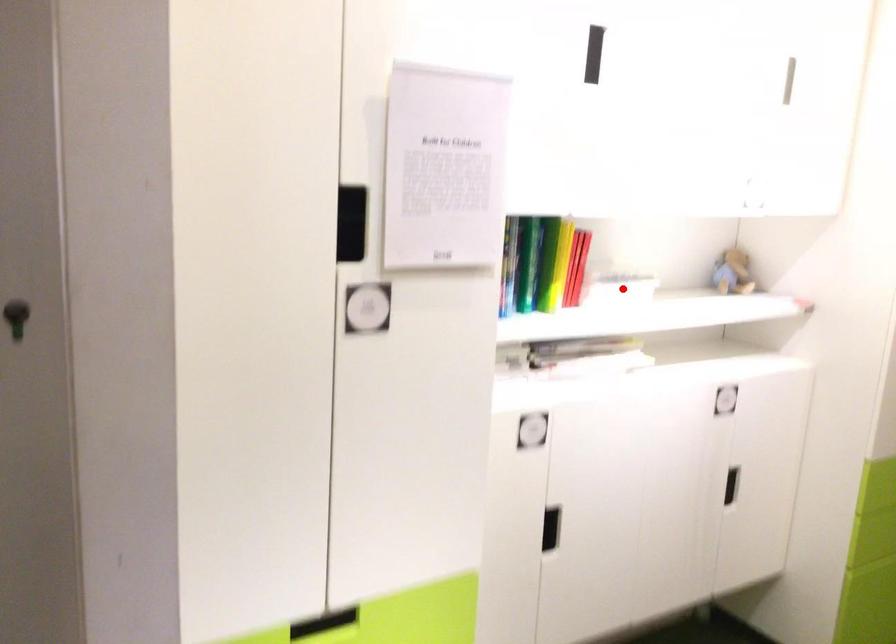
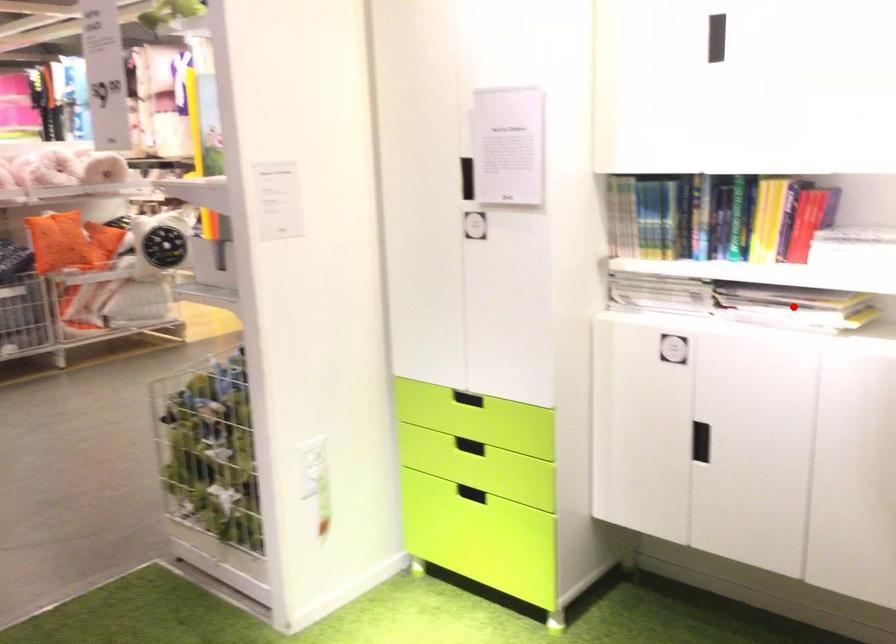
I am providing you with two images of the same scene from different viewpoints. A red point is marked on the first image and another point is marked on the second image. Is the red point in image1 aligned with the point shown in image2?

No